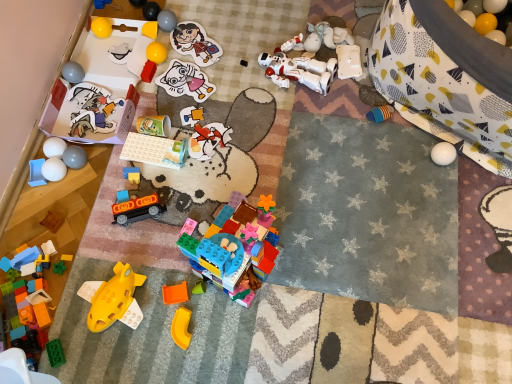
Find the location of `vacant area situated to the left side of matte gray ball at left, the ninth toy when ordered from left to right`. vacant area situated to the left side of matte gray ball at left, the ninth toy when ordered from left to right is located at coordinates (29, 173).